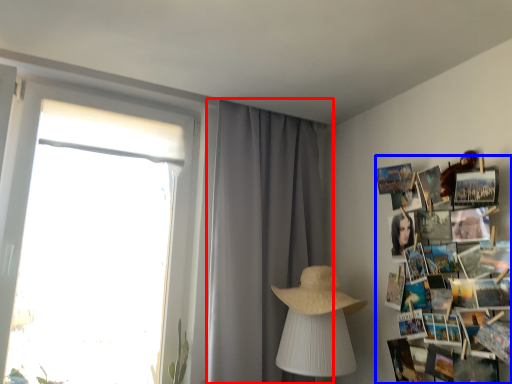
Question: Which object is closer to the camera taking this photo, curtain (highlighted by a red box) or magazine (highlighted by a blue box)?

Choices:
 (A) curtain
 (B) magazine

Answer: (B)